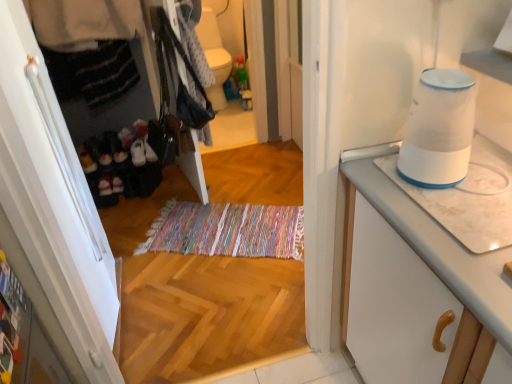
The height and width of the screenshot is (384, 512). What are the coordinates of `free point to the left of white plastic humidifier at upper right` in the screenshot? It's located at (379, 180).